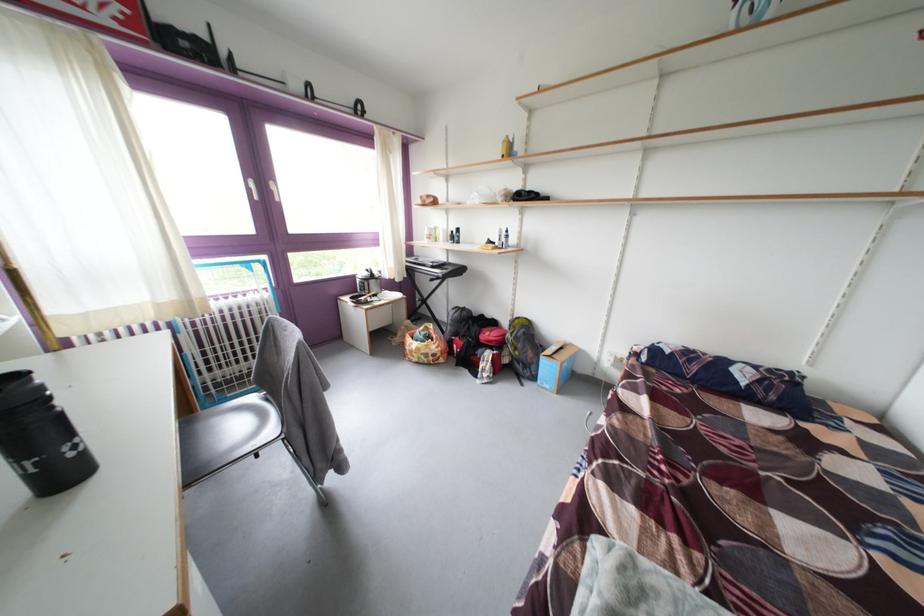
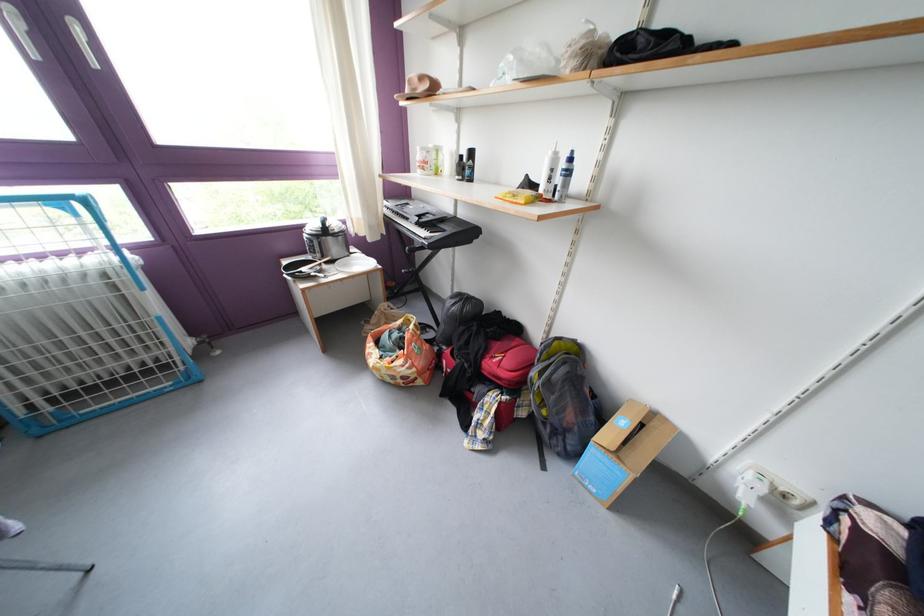
Where in the second image is the point corresponding to [501,249] from the first image?

(540, 191)